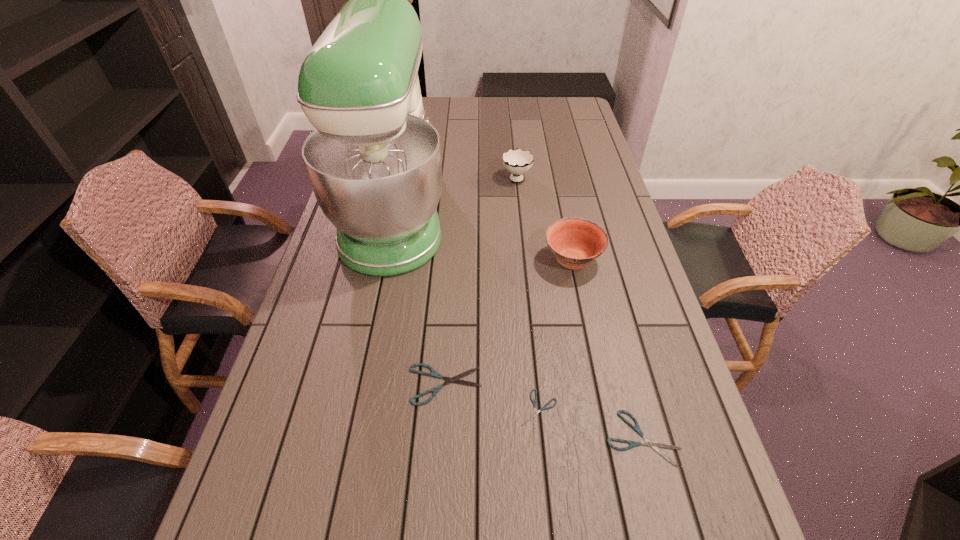
This screenshot has height=540, width=960. I want to click on empty space between the leftmost shears and the bowl, so click(509, 322).

Identify the location of free point between the shortest shears and the bowl. The image size is (960, 540). (556, 335).

Find the location of `free space that is in between the bowl and the tallest object`. free space that is in between the bowl and the tallest object is located at coordinates (484, 238).

The image size is (960, 540). I want to click on vacant space that's between the second tallest shears and the cup, so click(x=579, y=307).

I want to click on free space between the rightmost shears and the mixer, so click(x=518, y=327).

Locate an element on the screen. The height and width of the screenshot is (540, 960). blank region between the shortest shears and the leftmost shears is located at coordinates (492, 397).

At what (x,y) coordinates should I click in order to perform the action: click on the closest object to the shortest shears. Please return your answer as a coordinate pair (x, y). This screenshot has height=540, width=960. Looking at the image, I should click on (455, 379).

Find the location of a particular element. The image size is (960, 540). object identified as the closest to the mixer is located at coordinates (517, 162).

Identify which shears is the nearest to the mixer. Please provide its 2D coordinates. Your answer should be formatted as a tuple, i.e. [(x, y)], where the tuple contains the x and y coordinates of a point satisfying the conditions above.

[(455, 379)]

Locate an element on the screen. shears that is the second closest to the leftmost shears is located at coordinates (654, 445).